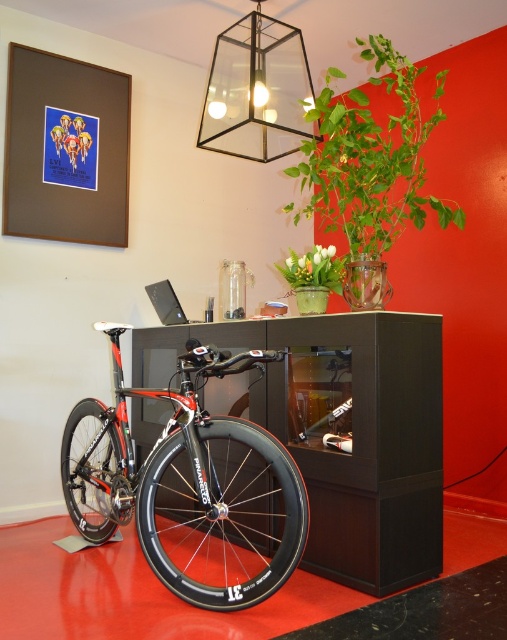
Between black carbon fiber wheel at center and green matte vase at center, which one appears on the left side from the viewer's perspective?

Positioned to the left is black carbon fiber wheel at center.

Identify the location of black carbon fiber wheel at center. This screenshot has width=507, height=640. (223, 516).

Between black carbon fiber wheel at center and satin black laptop at center, which one has more height?

With more height is black carbon fiber wheel at center.

Is black carbon fiber wheel at center positioned before satin black laptop at center?

Yes, it is in front of satin black laptop at center.

Where is `black carbon fiber wheel at center`? This screenshot has width=507, height=640. black carbon fiber wheel at center is located at coordinates (223, 516).

Is black carbon fiber wheel at center smaller than green leafy plant at upper right?

Indeed, black carbon fiber wheel at center has a smaller size compared to green leafy plant at upper right.

Between black carbon fiber wheel at center and green leafy plant at upper right, which one appears on the right side from the viewer's perspective?

green leafy plant at upper right

Which is behind, point (259, 582) or point (383, 84)?

The point (383, 84) is more distant.

Where is `black carbon fiber wheel at center`? Image resolution: width=507 pixels, height=640 pixels. black carbon fiber wheel at center is located at coordinates (223, 516).